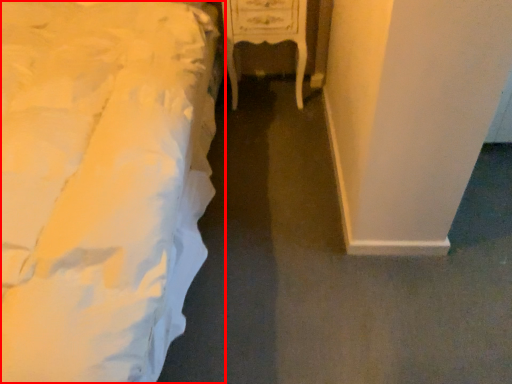
Question: Where is bed (annotated by the red box) located in relation to furniture in the image?

Choices:
 (A) left
 (B) right

Answer: (A)